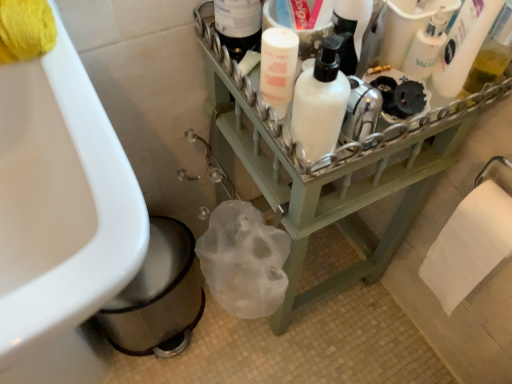
Question: Is white glossy sink at lower left positioned before translucent plastic bottle at upper right, the fourth cleaning product when ordered from left to right?

Choices:
 (A) no
 (B) yes

Answer: (B)

Question: Is white glossy sink at lower left oriented away from translucent plastic bottle at upper right, the 1th cleaning product when ordered from right to left?

Choices:
 (A) no
 (B) yes

Answer: (A)

Question: Are white glossy sink at lower left and translucent plastic bottle at upper right, the 1th cleaning product when ordered from right to left, located far from each other?

Choices:
 (A) yes
 (B) no

Answer: (B)

Question: Can you confirm if white glossy sink at lower left is taller than translucent plastic bottle at upper right, the 1th cleaning product when ordered from right to left?

Choices:
 (A) yes
 (B) no

Answer: (A)

Question: From a real-world perspective, is white glossy sink at lower left on top of translucent plastic bottle at upper right, the fourth cleaning product when ordered from left to right?

Choices:
 (A) yes
 (B) no

Answer: (B)

Question: From the image's perspective, is white glossy sink at lower left on translucent plastic bottle at upper right, the 1th cleaning product when ordered from right to left?

Choices:
 (A) yes
 (B) no

Answer: (B)

Question: Can you confirm if white matte pump bottle at upper center, the 4th cleaning product when ordered from right to left, is bigger than white glossy sink at lower left?

Choices:
 (A) no
 (B) yes

Answer: (A)

Question: Is white matte pump bottle at upper center, the 4th cleaning product when ordered from right to left, not inside white glossy sink at lower left?

Choices:
 (A) no
 (B) yes

Answer: (B)

Question: Does white matte pump bottle at upper center, the 4th cleaning product when ordered from right to left, have a greater width compared to white glossy sink at lower left?

Choices:
 (A) no
 (B) yes

Answer: (A)

Question: Can you confirm if white matte pump bottle at upper center, which is the 1th cleaning product in left-to-right order, is thinner than white glossy sink at lower left?

Choices:
 (A) no
 (B) yes

Answer: (B)

Question: From the image's perspective, is white matte pump bottle at upper center, which is the 1th cleaning product in left-to-right order, located above white glossy sink at lower left?

Choices:
 (A) yes
 (B) no

Answer: (A)

Question: Is white matte pump bottle at upper center, which is the 1th cleaning product in left-to-right order, beside white glossy sink at lower left?

Choices:
 (A) yes
 (B) no

Answer: (B)

Question: Is white paper towel at lower right, positioned as the 2th toilet paper in front-to-back order, at the left side of green wood shelf at center?

Choices:
 (A) yes
 (B) no

Answer: (B)